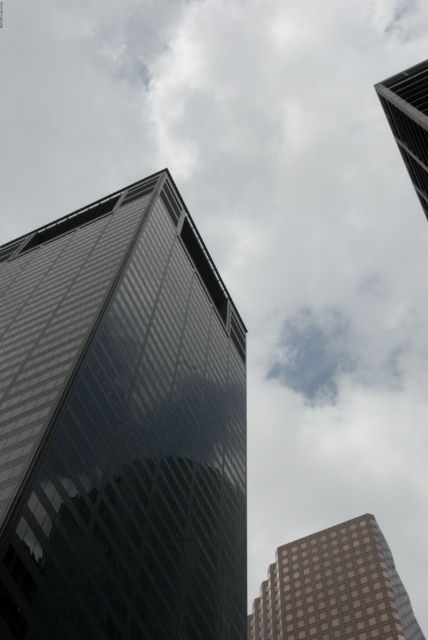
Is point (20, 449) closer to camera compared to point (412, 170)?

Yes.

Can you confirm if shiny glass tower at center is positioned below glassy reflective skyscraper at upper right?

Correct, shiny glass tower at center is located below glassy reflective skyscraper at upper right.

The width and height of the screenshot is (428, 640). Identify the location of shiny glass tower at center. (121, 428).

Is point (186, 435) less distant than point (347, 547)?

Yes, it is in front of point (347, 547).

The width and height of the screenshot is (428, 640). Find the location of `shiny glass tower at center`. shiny glass tower at center is located at coordinates (121, 428).

Is brown grid-patterned building at lower right thinner than glassy reflective skyscraper at upper right?

No, brown grid-patterned building at lower right is not thinner than glassy reflective skyscraper at upper right.

Which of these two, brown grid-patterned building at lower right or glassy reflective skyscraper at upper right, stands taller?

brown grid-patterned building at lower right

Is point (351, 554) more distant than point (407, 77)?

That is True.

The width and height of the screenshot is (428, 640). In order to click on brown grid-patterned building at lower right in this screenshot , I will do `click(333, 588)`.